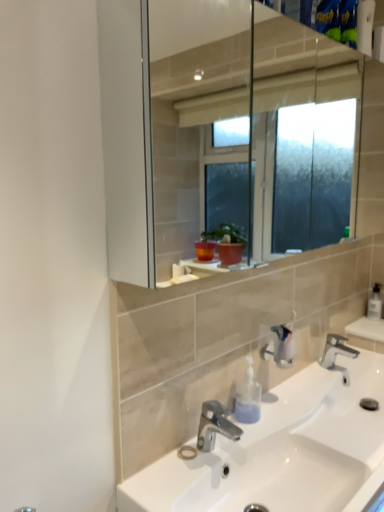
Identify the location of clear plastic soap dispenser at right, marked as the 1th soap dispenser in a back-to-front arrangement. (375, 303).

What is the approximate height of polished chrome faucet at center, acting as the 2th tap starting from the back?

The height of polished chrome faucet at center, acting as the 2th tap starting from the back, is 4.97 inches.

This screenshot has width=384, height=512. What are the coordinates of `translucent plastic soap dispenser at lower center, the first soap dispenser when ordered from front to back` in the screenshot? It's located at (248, 397).

The height and width of the screenshot is (512, 384). What are the coordinates of `satin nickel faucet at center` in the screenshot? It's located at (281, 346).

What do you see at coordinates (336, 355) in the screenshot? The image size is (384, 512). I see `polished chrome faucet at lower center, positioned as the 1th tap in right-to-left order` at bounding box center [336, 355].

Locate an element on the screen. This screenshot has height=512, width=384. polished chrome faucet at lower center, acting as the second tap starting from the left is located at coordinates (336, 355).

Where is `clear plastic soap dispenser at right, marked as the 1th soap dispenser in a back-to-front arrangement`? clear plastic soap dispenser at right, marked as the 1th soap dispenser in a back-to-front arrangement is located at coordinates (375, 303).

Considering the sizes of satin nickel faucet at center and polished chrome faucet at center, which appears as the 1th tap when viewed from the front, in the image, is satin nickel faucet at center wider or thinner than polished chrome faucet at center, which appears as the 1th tap when viewed from the front,?

In the image, satin nickel faucet at center appears to be more narrow than polished chrome faucet at center, which appears as the 1th tap when viewed from the front.

Is satin nickel faucet at center aimed at polished chrome faucet at center, which appears as the 2th tap when viewed from the right?

No, satin nickel faucet at center is not turned towards polished chrome faucet at center, which appears as the 2th tap when viewed from the right.

Could you measure the distance between satin nickel faucet at center and polished chrome faucet at center, acting as the first tap starting from the left?

satin nickel faucet at center and polished chrome faucet at center, acting as the first tap starting from the left, are 10.86 inches apart from each other.

From a real-world perspective, which is physically above, satin nickel faucet at center or polished chrome faucet at center, acting as the first tap starting from the left?

From a 3D spatial view, satin nickel faucet at center is above.

Can you confirm if polished chrome faucet at center, acting as the 2th tap starting from the back, is taller than polished chrome faucet at lower center, which is the first tap from back to front?

Yes.

Can you tell me how much polished chrome faucet at center, acting as the 2th tap starting from the back, and polished chrome faucet at lower center, acting as the second tap starting from the left, differ in facing direction?

They differ by 3.26 degrees in their facing directions.

From the image's perspective, does polished chrome faucet at center, which appears as the 1th tap when viewed from the front, appear lower than polished chrome faucet at lower center, positioned as the 1th tap in right-to-left order?

Yes, from the image's perspective, polished chrome faucet at center, which appears as the 1th tap when viewed from the front, is below polished chrome faucet at lower center, positioned as the 1th tap in right-to-left order.

Between polished chrome faucet at center, which appears as the 1th tap when viewed from the front, and polished chrome faucet at lower center, positioned as the 1th tap in right-to-left order, which one appears on the right side from the viewer's perspective?

polished chrome faucet at lower center, positioned as the 1th tap in right-to-left order.

In the image, is white ceramic sink at center positioned in front of or behind polished chrome faucet at center, acting as the first tap starting from the left?

Visually, white ceramic sink at center is located in front of polished chrome faucet at center, acting as the first tap starting from the left.

Does white ceramic sink at center appear on the left side of polished chrome faucet at center, which appears as the 1th tap when viewed from the front?

No.

What are the coordinates of `the 1st tap behind the white ceramic sink at center, counting from the anchor's position` in the screenshot? It's located at (215, 425).

How many degrees apart are the facing directions of white ceramic sink at center and polished chrome faucet at center, which appears as the 1th tap when viewed from the front?

They differ by 0.338 degrees in their facing directions.

In terms of size, does satin nickel faucet at center appear bigger or smaller than clear plastic soap dispenser at right, marked as the 1th soap dispenser in a back-to-front arrangement?

Considering their sizes, satin nickel faucet at center takes up more space than clear plastic soap dispenser at right, marked as the 1th soap dispenser in a back-to-front arrangement.

From a real-world perspective, is satin nickel faucet at center physically located above or below clear plastic soap dispenser at right, marked as the 1th soap dispenser in a back-to-front arrangement?

From a real-world perspective, satin nickel faucet at center is physically above clear plastic soap dispenser at right, marked as the 1th soap dispenser in a back-to-front arrangement.

Is clear plastic soap dispenser at right, which is counted as the second soap dispenser, starting from the front, at the back of satin nickel faucet at center?

No.

Consider the image. Between satin nickel faucet at center and clear plastic soap dispenser at right, which ranks as the 2th soap dispenser in bottom-to-top order, which one has less height?

clear plastic soap dispenser at right, which ranks as the 2th soap dispenser in bottom-to-top order.

Considering the relative sizes of satin nickel faucet at center and white ceramic sink at center in the image provided, is satin nickel faucet at center smaller than white ceramic sink at center?

Indeed, satin nickel faucet at center has a smaller size compared to white ceramic sink at center.

How different are the orientations of satin nickel faucet at center and white ceramic sink at center in degrees?

0.661 degrees.

Considering the relative sizes of satin nickel faucet at center and white ceramic sink at center in the image provided, is satin nickel faucet at center thinner than white ceramic sink at center?

Yes.

In terms of height, does satin nickel faucet at center look taller or shorter compared to white ceramic sink at center?

Clearly, satin nickel faucet at center is taller compared to white ceramic sink at center.

Considering the sizes of clear plastic soap dispenser at right, which ranks as the first soap dispenser in right-to-left order, and translucent plastic soap dispenser at lower center, the 2th soap dispenser viewed from the right, in the image, is clear plastic soap dispenser at right, which ranks as the first soap dispenser in right-to-left order, wider or thinner than translucent plastic soap dispenser at lower center, the 2th soap dispenser viewed from the right,?

clear plastic soap dispenser at right, which ranks as the first soap dispenser in right-to-left order, is wider than translucent plastic soap dispenser at lower center, the 2th soap dispenser viewed from the right.

From a real-world perspective, which object stands above the other?

clear plastic soap dispenser at right, which ranks as the first soap dispenser in right-to-left order, is physically above.

From the image's perspective, which is above, clear plastic soap dispenser at right, which ranks as the first soap dispenser in right-to-left order, or translucent plastic soap dispenser at lower center, arranged as the 2th soap dispenser when viewed from the back?

clear plastic soap dispenser at right, which ranks as the first soap dispenser in right-to-left order, from the image's perspective.

Is clear plastic soap dispenser at right, which ranks as the 2th soap dispenser in bottom-to-top order, positioned with its back to translucent plastic soap dispenser at lower center, arranged as the 2th soap dispenser when viewed from the back?

No, clear plastic soap dispenser at right, which ranks as the 2th soap dispenser in bottom-to-top order, is not facing away from translucent plastic soap dispenser at lower center, arranged as the 2th soap dispenser when viewed from the back.

From a real-world perspective, is polished chrome faucet at lower center, which is the first tap from back to front, over clear plastic soap dispenser at right, which appears as the second soap dispenser when viewed from the left?

No.

Is polished chrome faucet at lower center, which is the second tap in front-to-back order, located outside clear plastic soap dispenser at right, which ranks as the first soap dispenser in right-to-left order?

Yes, polished chrome faucet at lower center, which is the second tap in front-to-back order, is not within clear plastic soap dispenser at right, which ranks as the first soap dispenser in right-to-left order.

How different are the orientations of polished chrome faucet at lower center, acting as the second tap starting from the left, and clear plastic soap dispenser at right, which ranks as the 2th soap dispenser in bottom-to-top order, in degrees?

92.6 degrees separate the facing orientations of polished chrome faucet at lower center, acting as the second tap starting from the left, and clear plastic soap dispenser at right, which ranks as the 2th soap dispenser in bottom-to-top order.

This screenshot has height=512, width=384. What are the coordinates of `plumbing fixture to the right of polished chrome faucet at center, acting as the first tap starting from the left` in the screenshot? It's located at (281, 346).

In order to click on tap in front of the polished chrome faucet at lower center, acting as the second tap starting from the left in this screenshot , I will do `click(215, 425)`.

When comparing their distances from polished chrome faucet at center, which appears as the 1th tap when viewed from the front, does clear plastic soap dispenser at right, which is counted as the second soap dispenser, starting from the front, or white ceramic sink at center seem further?

clear plastic soap dispenser at right, which is counted as the second soap dispenser, starting from the front, is further to polished chrome faucet at center, which appears as the 1th tap when viewed from the front.

Which object lies further to the anchor point white ceramic sink at center, polished chrome faucet at lower center, which is the second tap in front-to-back order, or polished chrome faucet at center, acting as the 2th tap starting from the back?

polished chrome faucet at lower center, which is the second tap in front-to-back order, is further to white ceramic sink at center.

Based on their spatial positions, is white ceramic sink at center or translucent plastic soap dispenser at lower center, the first soap dispenser when ordered from front to back, further from clear plastic soap dispenser at right, marked as the 1th soap dispenser in a back-to-front arrangement?

translucent plastic soap dispenser at lower center, the first soap dispenser when ordered from front to back.

From the picture: From the image, which object appears to be nearer to translucent plastic soap dispenser at lower center, arranged as the 2th soap dispenser when viewed from the top, clear plastic soap dispenser at right, marked as the 1th soap dispenser in a back-to-front arrangement, or polished chrome faucet at lower center, which is the second tap in front-to-back order?

The object closer to translucent plastic soap dispenser at lower center, arranged as the 2th soap dispenser when viewed from the top, is polished chrome faucet at lower center, which is the second tap in front-to-back order.

From the picture: When comparing their distances from white ceramic sink at center, does satin nickel faucet at center or polished chrome faucet at lower center, acting as the second tap starting from the left, seem further?

polished chrome faucet at lower center, acting as the second tap starting from the left, lies further to white ceramic sink at center than the other object.

In the scene shown: Based on their spatial positions, is translucent plastic soap dispenser at lower center, placed as the first soap dispenser when sorted from bottom to top, or polished chrome faucet at lower center, positioned as the 1th tap in right-to-left order, further from clear plastic soap dispenser at right, which ranks as the first soap dispenser in right-to-left order?

translucent plastic soap dispenser at lower center, placed as the first soap dispenser when sorted from bottom to top.

Which object lies nearer to the anchor point clear plastic soap dispenser at right, the first soap dispenser in the top-to-bottom sequence, polished chrome faucet at lower center, acting as the second tap starting from the left, or translucent plastic soap dispenser at lower center, which ranks as the first soap dispenser in left-to-right order?

polished chrome faucet at lower center, acting as the second tap starting from the left, is closer to clear plastic soap dispenser at right, the first soap dispenser in the top-to-bottom sequence.

In the scene shown: Looking at the image, which one is located further to satin nickel faucet at center, clear plastic soap dispenser at right, which appears as the second soap dispenser when viewed from the left, or polished chrome faucet at center, which appears as the 1th tap when viewed from the front?

Based on the image, clear plastic soap dispenser at right, which appears as the second soap dispenser when viewed from the left, appears to be further to satin nickel faucet at center.

At what (x,y) coordinates should I click in order to perform the action: click on soap dispenser between white ceramic sink at center and polished chrome faucet at lower center, acting as the second tap starting from the left, from front to back. Please return your answer as a coordinate pair (x, y). Looking at the image, I should click on (248, 397).

Identify the location of plumbing fixture located between white ceramic sink at center and clear plastic soap dispenser at right, the first soap dispenser in the top-to-bottom sequence, in the depth direction. (281, 346).

The height and width of the screenshot is (512, 384). Identify the location of tap positioned between white ceramic sink at center and polished chrome faucet at lower center, acting as the second tap starting from the left, from near to far. (215, 425).

The width and height of the screenshot is (384, 512). Identify the location of plumbing fixture located between polished chrome faucet at center, acting as the 2th tap starting from the back, and polished chrome faucet at lower center, which is the second tap in front-to-back order, in the depth direction. click(x=281, y=346).